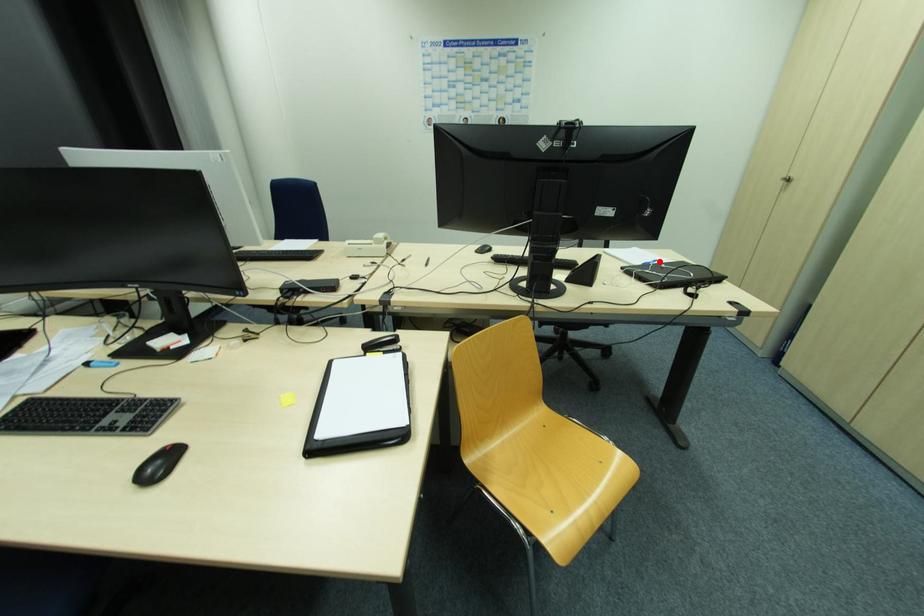
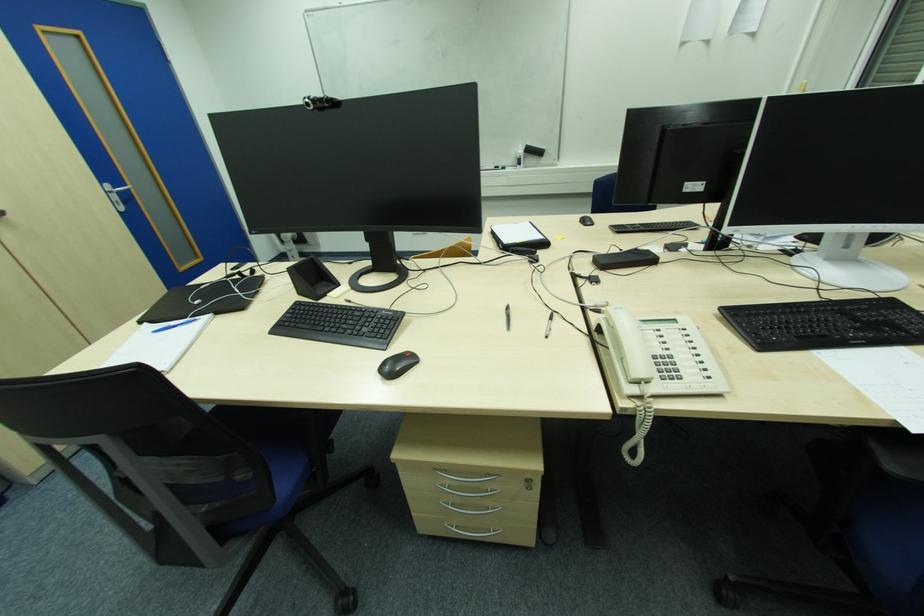
Find the pixel in the second image that matches the highlighted location in the first image.

(156, 333)